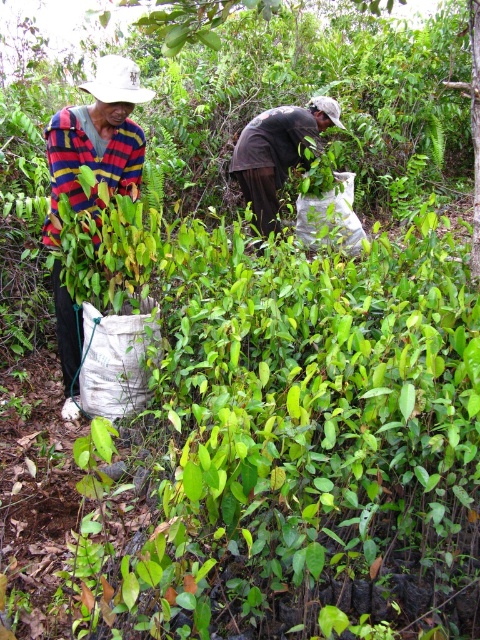
Is striped fabric shirt at left shorter than brown fabric bag at center?

In fact, striped fabric shirt at left may be taller than brown fabric bag at center.

How distant is striped fabric shirt at left from brown fabric bag at center?

The distance of striped fabric shirt at left from brown fabric bag at center is 1.62 meters.

Who is more distant from viewer, (x=74, y=336) or (x=300, y=116)?

The point (x=300, y=116) is behind.

Identify the location of striped fabric shirt at left. (96, 141).